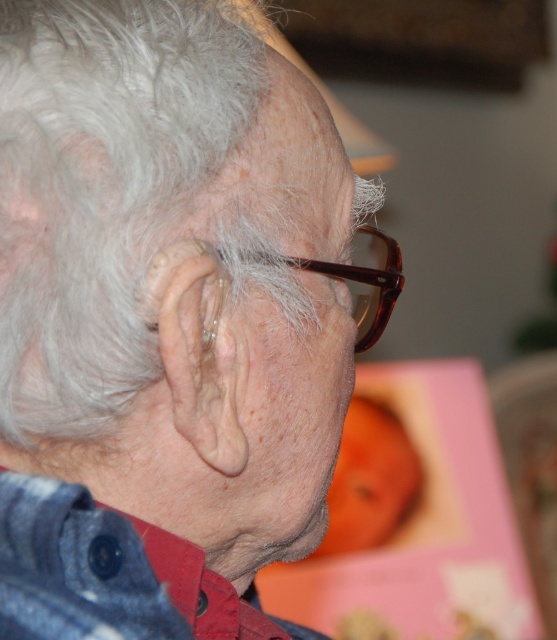
Who is more distant from viewer, (144, 467) or (252, 253)?

Point (252, 253)

Which of these two, matte brown glasses at center or brown tortoiseshell glasses at center, stands taller?

With more height is matte brown glasses at center.

Is point (217, 52) in front of point (383, 308)?

Yes, it is in front of point (383, 308).

You are a GUI agent. You are given a task and a screenshot of the screen. Output one action in this format:
    pyautogui.click(x=<x>, y=<y>)
    Task: Click on the matte brown glasses at center
    This screenshot has height=640, width=557.
    Given the screenshot: What is the action you would take?
    pyautogui.click(x=164, y=317)